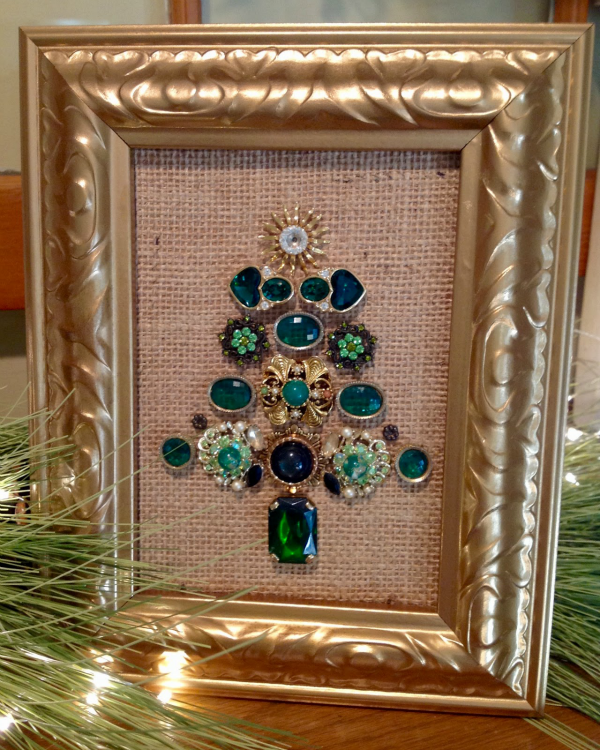
Find the location of a particular element. brown wooden table/surface is located at coordinates (410, 735).